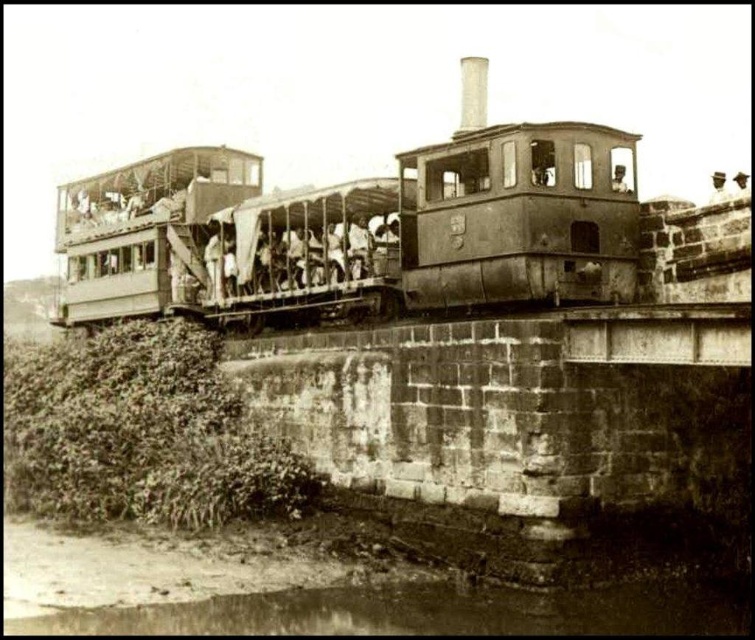
Question: Where is rusty metal train at center located in relation to brown dirt river at lower left in the image?

Choices:
 (A) below
 (B) above

Answer: (B)

Question: Does rusty metal train at center have a smaller size compared to brown dirt river at lower left?

Choices:
 (A) no
 (B) yes

Answer: (A)

Question: Which point is farther to the camera?

Choices:
 (A) brown dirt river at lower left
 (B) rusty metal train at center

Answer: (B)

Question: Which point is farther to the camera?

Choices:
 (A) brown dirt river at lower left
 (B) rusty metal train at center

Answer: (B)

Question: Can you confirm if rusty metal train at center is wider than brown dirt river at lower left?

Choices:
 (A) no
 (B) yes

Answer: (B)